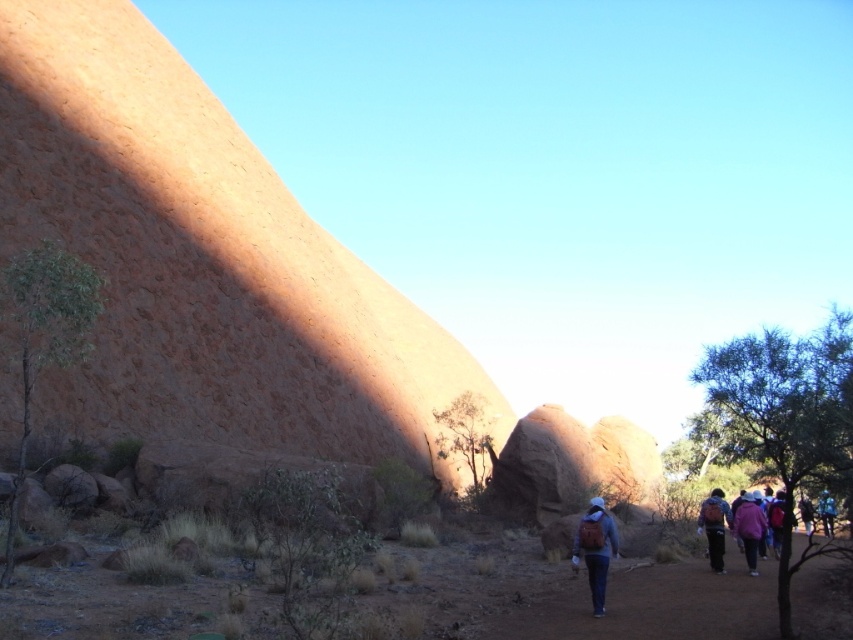
Which is in front, point (590, 548) or point (751, 564)?

Point (590, 548) is more forward.

Can you confirm if matte blue backpack at center is positioned to the left of matte pink jacket at lower right?

Indeed, matte blue backpack at center is positioned on the left side of matte pink jacket at lower right.

Which is in front, point (606, 540) or point (756, 557)?

Point (606, 540)

This screenshot has width=853, height=640. Identify the location of matte blue backpack at center. pyautogui.click(x=596, y=548).

Can you confirm if brown dirt trail at lower center is positioned to the right of matte pink jacket at lower right?

No, brown dirt trail at lower center is not to the right of matte pink jacket at lower right.

Is brown dirt trail at lower center wider than matte pink jacket at lower right?

Correct, the width of brown dirt trail at lower center exceeds that of matte pink jacket at lower right.

This screenshot has width=853, height=640. In order to click on brown dirt trail at lower center in this screenshot , I will do `click(654, 605)`.

Identify the location of brown dirt trail at lower center. The height and width of the screenshot is (640, 853). (654, 605).

Locate an element on the screen. brown dirt trail at lower center is located at coordinates (x=654, y=605).

You are a GUI agent. You are given a task and a screenshot of the screen. Output one action in this format:
    pyautogui.click(x=<x>, y=<y>)
    Task: Click on the brown dirt trail at lower center
    The width and height of the screenshot is (853, 640).
    Given the screenshot: What is the action you would take?
    pyautogui.click(x=654, y=605)